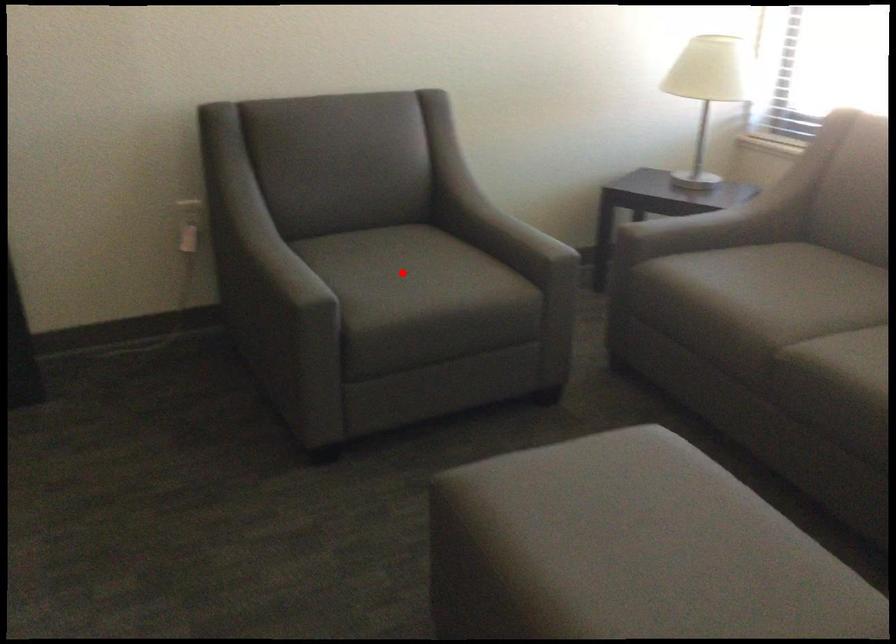
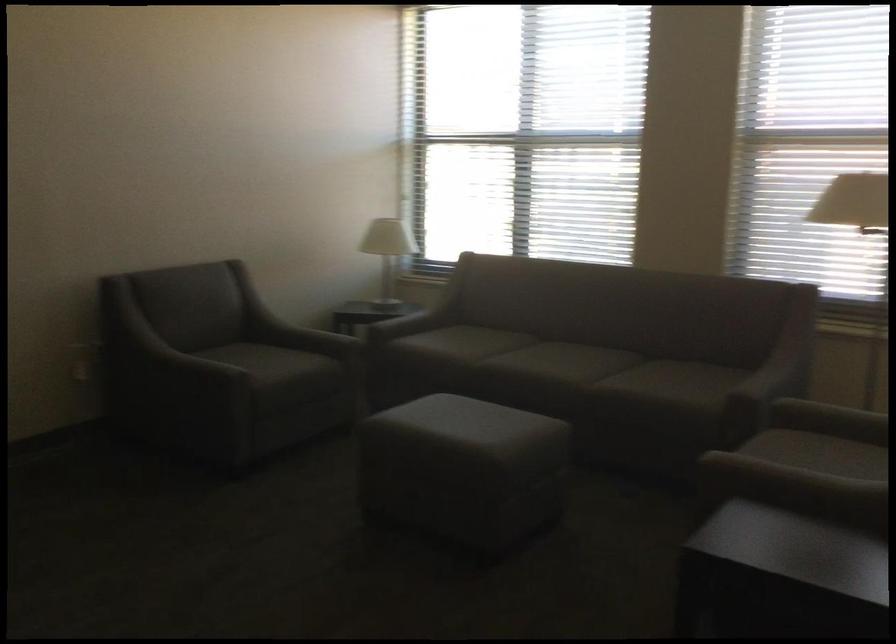
Question: I am providing you with two images of the same scene from different viewpoints. A red point is shown in image1. For the corresponding object point in image2, is it positioned nearer or farther from the camera?

Choices:
 (A) Nearer
 (B) Farther

Answer: (B)